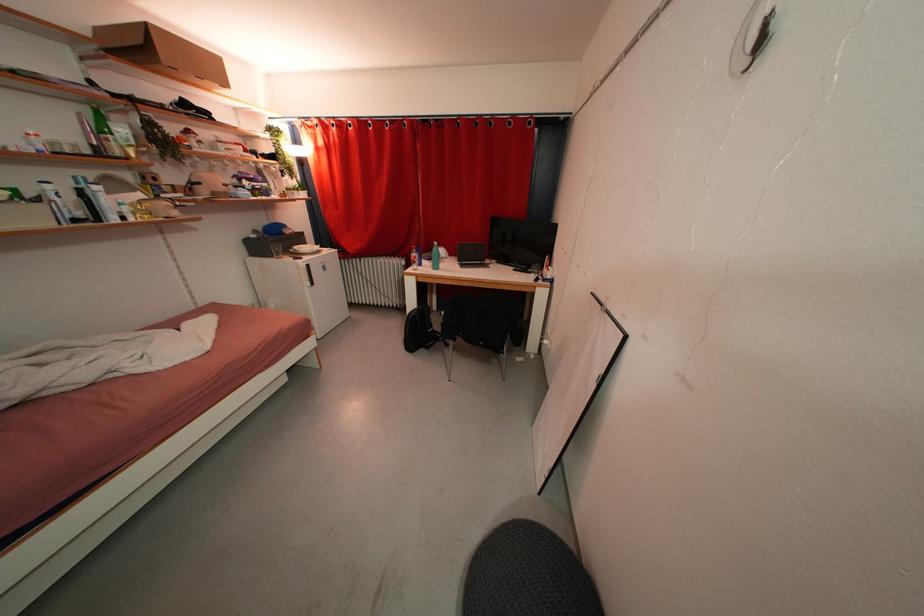
You are a GUI agent. You are given a task and a screenshot of the screen. Output one action in this format:
    pyautogui.click(x=<x>, y=<y>)
    Task: Click on the chair sitting surface
    
    Given the screenshot: What is the action you would take?
    pyautogui.click(x=481, y=323)